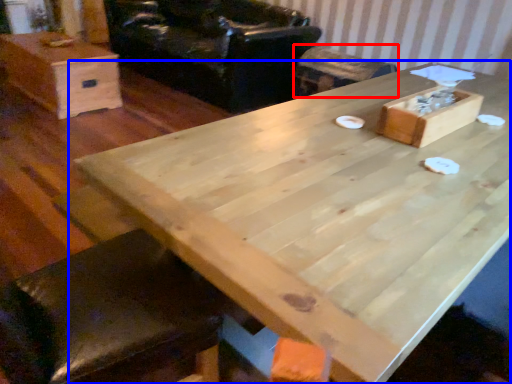
Question: Which object appears closest to the camera in this image, bar stool (highlighted by a red box) or table (highlighted by a blue box)?

Choices:
 (A) bar stool
 (B) table

Answer: (B)